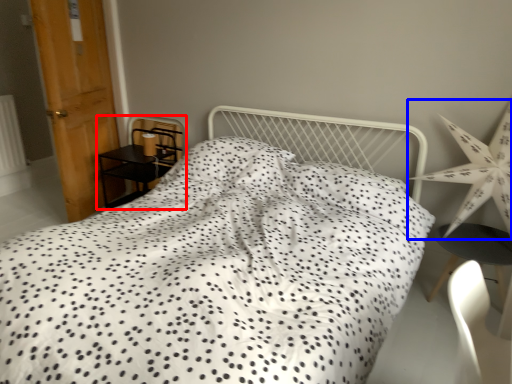
Question: Which point is further to the camera, furniture (highlighted by a red box) or star (highlighted by a blue box)?

Choices:
 (A) furniture
 (B) star

Answer: (A)